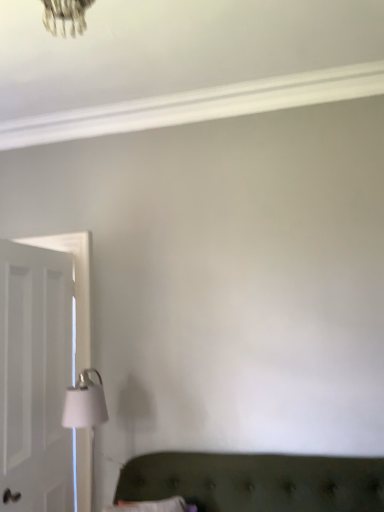
Question: Considering the positions of white matte table lamp at lower left and white wooden door at left in the image, is white matte table lamp at lower left wider or thinner than white wooden door at left?

Choices:
 (A) thin
 (B) wide

Answer: (B)

Question: In terms of height, does white matte table lamp at lower left look taller or shorter compared to white wooden door at left?

Choices:
 (A) short
 (B) tall

Answer: (A)

Question: From the image's perspective, relative to white wooden door at left, is white matte table lamp at lower left above or below?

Choices:
 (A) below
 (B) above

Answer: (A)

Question: Is white wooden door at left in front of or behind white matte table lamp at lower left in the image?

Choices:
 (A) front
 (B) behind

Answer: (A)

Question: Looking at their shapes, would you say white wooden door at left is wider or thinner than white matte table lamp at lower left?

Choices:
 (A) wide
 (B) thin

Answer: (B)

Question: From the image's perspective, is white wooden door at left positioned above or below white matte table lamp at lower left?

Choices:
 (A) below
 (B) above

Answer: (B)

Question: From a real-world perspective, is white wooden door at left above or below white matte table lamp at lower left?

Choices:
 (A) above
 (B) below

Answer: (A)